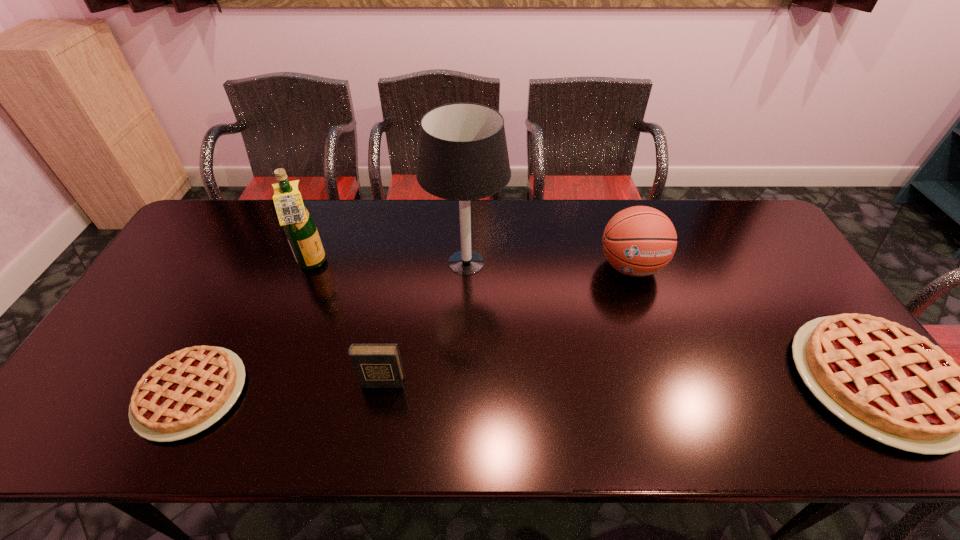
The width and height of the screenshot is (960, 540). I want to click on the leftmost object, so click(x=186, y=392).

The width and height of the screenshot is (960, 540). Find the location of `the shortest object`. the shortest object is located at coordinates (186, 392).

Identify the location of the third object from right to left. (463, 156).

At what (x,y) coordinates should I click in order to perform the action: click on the tallest object. Please return your answer as a coordinate pair (x, y). Image resolution: width=960 pixels, height=540 pixels. Looking at the image, I should click on (463, 156).

Find the location of `the second object from left to right`. the second object from left to right is located at coordinates (300, 229).

I want to click on liquor, so click(300, 229).

In order to click on the fourth shortest object in this screenshot , I will do `click(638, 241)`.

At what (x,y) coordinates should I click in order to perform the action: click on basketball. Please return your answer as a coordinate pair (x, y). This screenshot has width=960, height=540. Looking at the image, I should click on (638, 241).

The width and height of the screenshot is (960, 540). Identify the location of the third object from left to right. (376, 365).

Identify the location of the fourth tallest object. This screenshot has height=540, width=960. (376, 365).